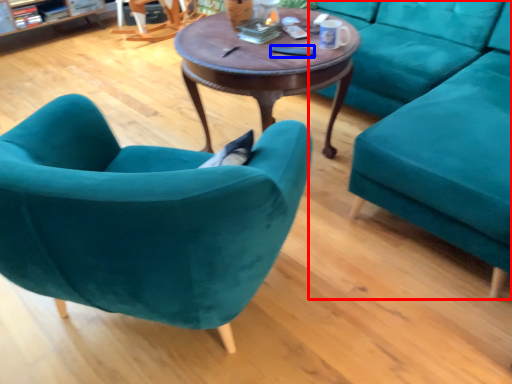
Question: Which object is closer to the camera taking this photo, studio couch (highlighted by a red box) or remote control (highlighted by a blue box)?

Choices:
 (A) studio couch
 (B) remote control

Answer: (A)